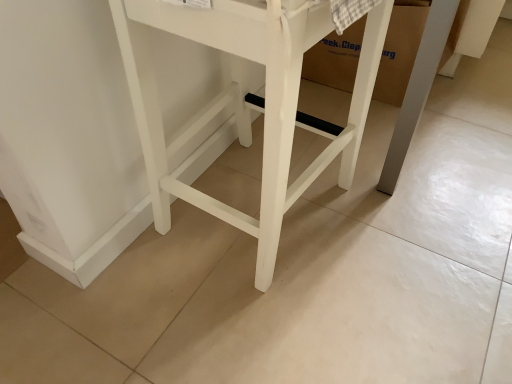
At what (x,y) coordinates should I click in order to perform the action: click on free spot below white matte stool at center (from a real-world perspective). Please return your answer as a coordinate pair (x, y). The image size is (512, 384). Looking at the image, I should click on (258, 205).